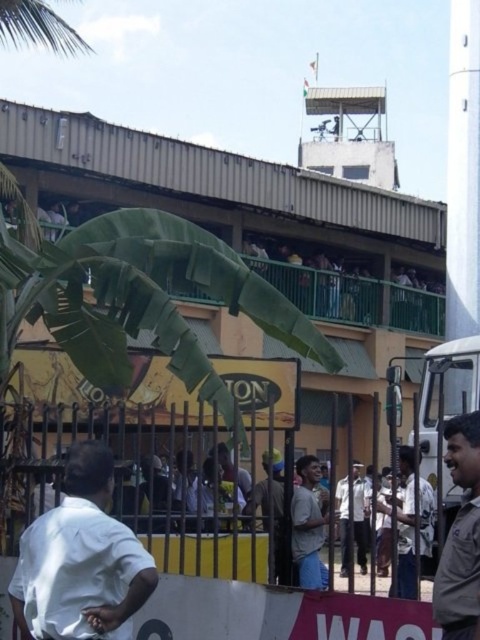
Does brown leather jacket at lower right have a larger size compared to dark gray shirt at center?

Incorrect, brown leather jacket at lower right is not larger than dark gray shirt at center.

Can you confirm if brown leather jacket at lower right is positioned to the right of dark gray shirt at center?

Indeed, brown leather jacket at lower right is positioned on the right side of dark gray shirt at center.

Which is behind, point (466, 547) or point (274, 461)?

The point (274, 461) is behind.

Identify the location of brown leather jacket at lower right. (460, 536).

Who is higher up, white cotton shirt at center or light gray shirt at center?

Positioned higher is white cotton shirt at center.

Which of these two, white cotton shirt at center or light gray shirt at center, stands taller?

white cotton shirt at center is taller.

The height and width of the screenshot is (640, 480). What are the coordinates of `white cotton shirt at center` in the screenshot? It's located at (406, 525).

Looking at this image, between white matte shirt at lower left and white cotton shirt at center, which one appears on the right side from the viewer's perspective?

Positioned to the right is white cotton shirt at center.

Who is taller, white matte shirt at lower left or white cotton shirt at center?

Standing taller between the two is white cotton shirt at center.

Is point (11, 600) positioned after point (396, 564)?

No.

You are a GUI agent. You are given a task and a screenshot of the screen. Output one action in this format:
    pyautogui.click(x=<x>, y=<y>)
    Task: Click on the white matte shirt at lower left
    
    Given the screenshot: What is the action you would take?
    click(81, 561)